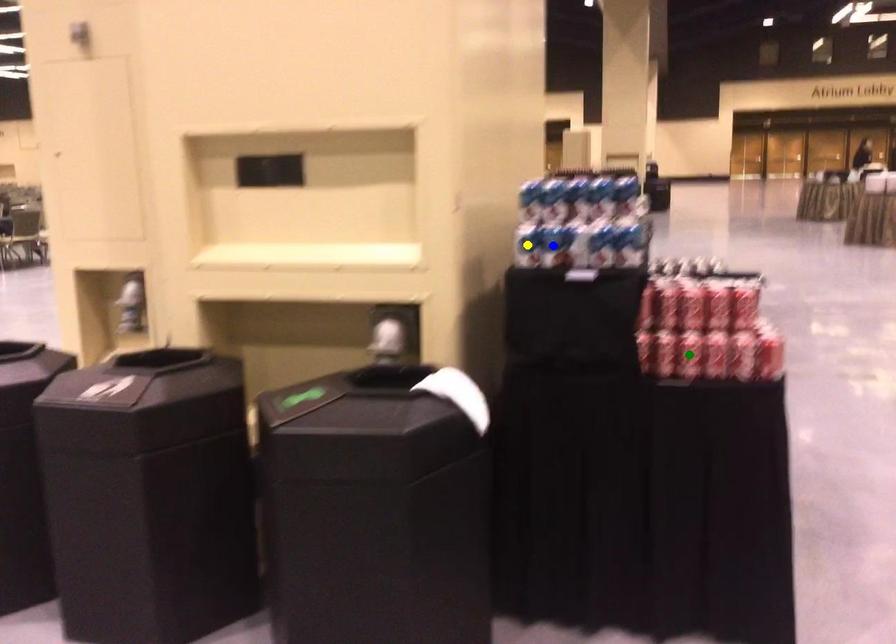
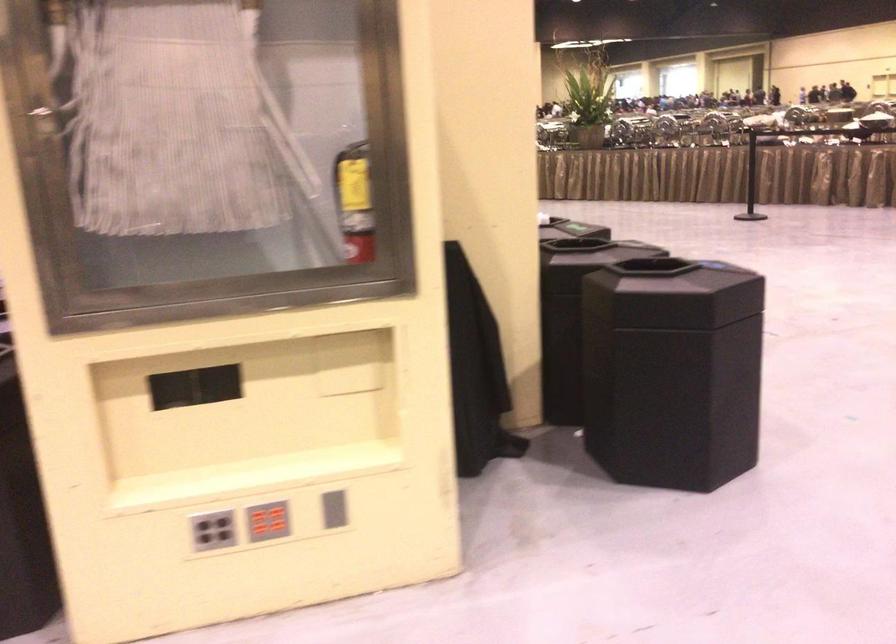
I am providing you with two images of the same scene from different viewpoints. Three points are marked in image1. Which point corresponds to a part or object that is occluded in image2?In image1, three points are marked. Which of them correspond to a part or object that is occluded in image2?Among the three points shown in image1, which one corresponds to a part or object that is no longer visible due to occlusion in image2?

blue point, yellow point, green point